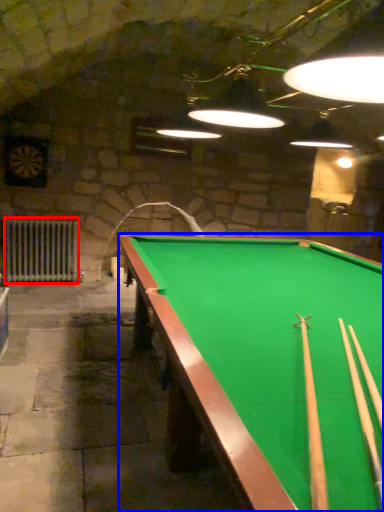
Question: Which point is further to the camera, radiator (highlighted by a red box) or billiard table (highlighted by a blue box)?

Choices:
 (A) radiator
 (B) billiard table

Answer: (A)